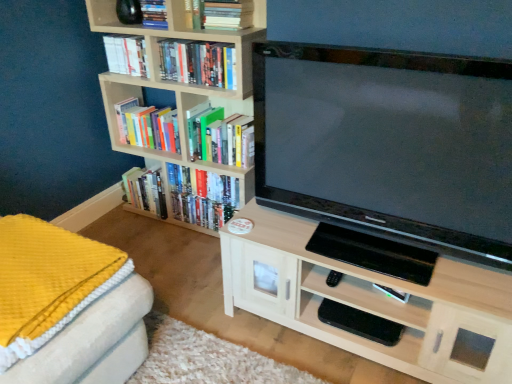
Question: Considering the relative positions of hardcover book at upper center, acting as the 1th book starting from the top, and hardcover book at center, placed as the 1th book when sorted from bottom to top, in the image provided, is hardcover book at upper center, acting as the 1th book starting from the top, in front of hardcover book at center, placed as the 1th book when sorted from bottom to top,?

Choices:
 (A) yes
 (B) no

Answer: (A)

Question: Can you confirm if hardcover book at upper center, acting as the 1th book starting from the top, is wider than hardcover book at center, placed as the 1th book when sorted from bottom to top?

Choices:
 (A) no
 (B) yes

Answer: (A)

Question: Is hardcover book at upper center, acting as the 1th book starting from the top, further to camera compared to hardcover book at center, which is the sixth book in top-to-bottom order?

Choices:
 (A) yes
 (B) no

Answer: (B)

Question: From the image's perspective, does hardcover book at upper center, acting as the 1th book starting from the top, appear higher than hardcover book at center, which is the sixth book in top-to-bottom order?

Choices:
 (A) yes
 (B) no

Answer: (A)

Question: Is hardcover book at upper center, acting as the 1th book starting from the top, at the left side of hardcover book at center, which is the sixth book in top-to-bottom order?

Choices:
 (A) no
 (B) yes

Answer: (B)

Question: Is hardcover book at upper center, acting as the 1th book starting from the top, turned away from hardcover book at center, which is the sixth book in top-to-bottom order?

Choices:
 (A) yes
 (B) no

Answer: (B)

Question: Is there a large distance between hardcover book at upper center, acting as the 1th book starting from the top, and matte black tv at center?

Choices:
 (A) no
 (B) yes

Answer: (B)

Question: Could you tell me if hardcover book at upper center, marked as the 6th book in a bottom-to-top arrangement, is facing matte black tv at center?

Choices:
 (A) yes
 (B) no

Answer: (B)

Question: Can you confirm if hardcover book at upper center, marked as the 6th book in a bottom-to-top arrangement, is bigger than matte black tv at center?

Choices:
 (A) no
 (B) yes

Answer: (A)

Question: Is hardcover book at upper center, acting as the 1th book starting from the top, positioned in front of matte black tv at center?

Choices:
 (A) yes
 (B) no

Answer: (B)

Question: Is the position of hardcover book at upper center, marked as the 6th book in a bottom-to-top arrangement, more distant than that of matte black tv at center?

Choices:
 (A) no
 (B) yes

Answer: (B)

Question: From a real-world perspective, is hardcover book at upper center, acting as the 1th book starting from the top, positioned under matte black tv at center based on gravity?

Choices:
 (A) no
 (B) yes

Answer: (A)

Question: From a real-world perspective, is hardcover book at center, placed as the 1th book when sorted from bottom to top, located higher than hardcover books at upper center, the 4th book positioned from the top?

Choices:
 (A) yes
 (B) no

Answer: (B)